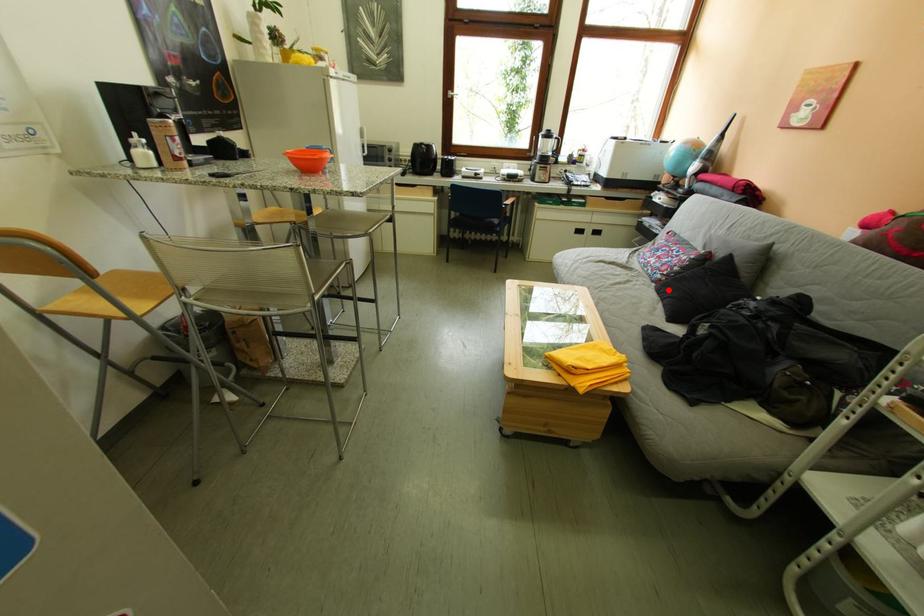
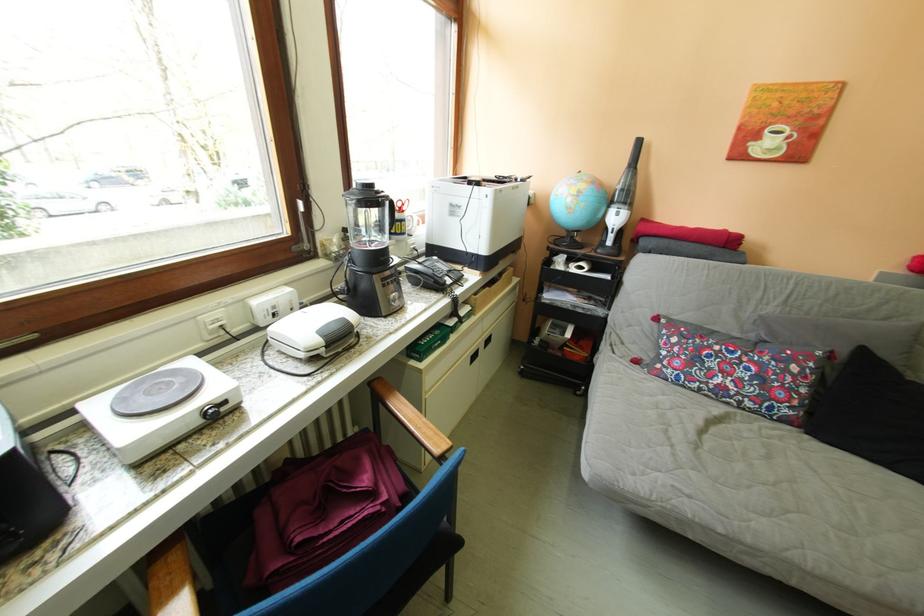
Where in the second image is the point corresponding to the highlighted location from the first image?

(821, 437)